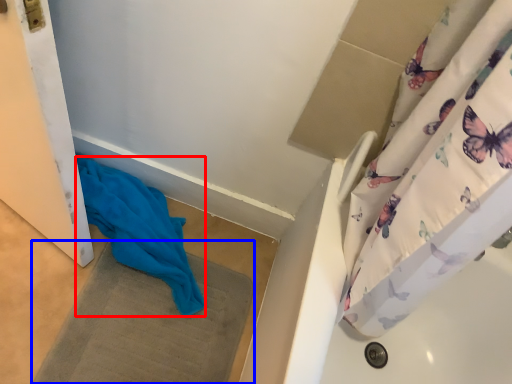
Question: Among these objects, which one is nearest to the camera, fabric (highlighted by a red box) or bath mat (highlighted by a blue box)?

Choices:
 (A) fabric
 (B) bath mat

Answer: (B)